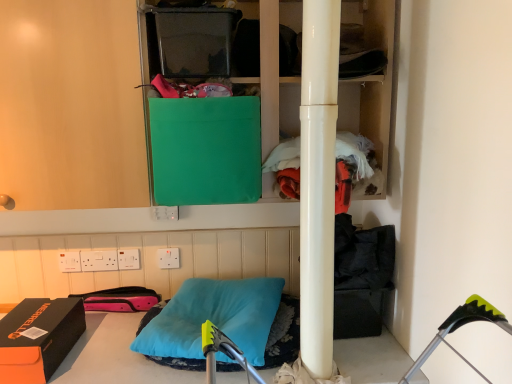
Question: Is glossy white pole at center positioned with its back to white plastic electric outlet at upper center, which is the third electric outlet from left to right?

Choices:
 (A) no
 (B) yes

Answer: (A)

Question: Can you confirm if glossy white pole at center is smaller than white plastic electric outlet at upper center, which is the third electric outlet from left to right?

Choices:
 (A) no
 (B) yes

Answer: (A)

Question: Could you tell me if glossy white pole at center is facing white plastic electric outlet at upper center, which is the third electric outlet from left to right?

Choices:
 (A) yes
 (B) no

Answer: (B)

Question: From a real-world perspective, is glossy white pole at center physically above white plastic electric outlet at upper center, the 3th electric outlet in the right-to-left sequence?

Choices:
 (A) no
 (B) yes

Answer: (B)

Question: Does glossy white pole at center have a lesser height compared to white plastic electric outlet at upper center, which is the third electric outlet from left to right?

Choices:
 (A) yes
 (B) no

Answer: (B)

Question: In the image, is white plastic electric outlet at center, the fourth electric outlet from the left, on the left side or the right side of orange fleece jacket at center right?

Choices:
 (A) right
 (B) left

Answer: (B)

Question: Is white plastic electric outlet at center, the fourth electric outlet from the left, bigger or smaller than orange fleece jacket at center right?

Choices:
 (A) big
 (B) small

Answer: (B)

Question: Considering their positions, is white plastic electric outlet at center, the fourth electric outlet from the left, located in front of or behind orange fleece jacket at center right?

Choices:
 (A) behind
 (B) front

Answer: (A)

Question: From a real-world perspective, is white plastic electric outlet at center, arranged as the second electric outlet when viewed from the right, physically located above or below orange fleece jacket at center right?

Choices:
 (A) above
 (B) below

Answer: (B)

Question: In the image, is teal soft pillow at center positioned in front of or behind glossy white pole at center?

Choices:
 (A) front
 (B) behind

Answer: (B)

Question: In the image, is teal soft pillow at center on the left side or the right side of glossy white pole at center?

Choices:
 (A) right
 (B) left

Answer: (B)

Question: In terms of height, does teal soft pillow at center look taller or shorter compared to glossy white pole at center?

Choices:
 (A) short
 (B) tall

Answer: (A)

Question: Considering the positions of point (177, 319) and point (336, 9), is point (177, 319) closer or farther from the camera than point (336, 9)?

Choices:
 (A) closer
 (B) farther

Answer: (B)

Question: Is point (361, 180) closer or farther from the camera than point (158, 329)?

Choices:
 (A) closer
 (B) farther

Answer: (B)

Question: From the image's perspective, is orange fleece jacket at center right above or below teal soft pillow at center?

Choices:
 (A) below
 (B) above

Answer: (B)